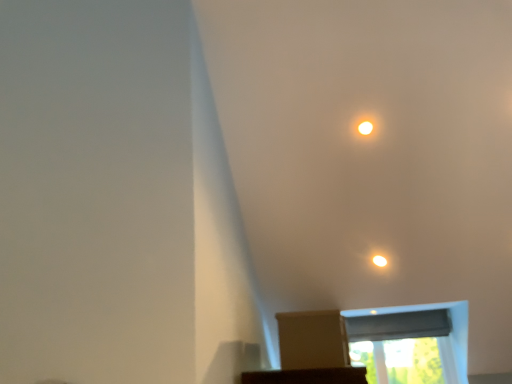
Question: Is black fabric window screen at lower center, the second window screen when ordered from bottom to top, closer to camera compared to matte white light at upper center?

Choices:
 (A) yes
 (B) no

Answer: (B)

Question: Is black fabric window screen at lower center, the 1th window screen in the top-to-bottom sequence, to the right of matte white light at upper center from the viewer's perspective?

Choices:
 (A) no
 (B) yes

Answer: (B)

Question: Can you confirm if black fabric window screen at lower center, the 1th window screen in the top-to-bottom sequence, is wider than matte white light at upper center?

Choices:
 (A) yes
 (B) no

Answer: (A)

Question: From a real-world perspective, is black fabric window screen at lower center, the 1th window screen in the top-to-bottom sequence, below matte white light at upper center?

Choices:
 (A) yes
 (B) no

Answer: (A)

Question: From the image's perspective, does black fabric window screen at lower center, the 1th window screen in the top-to-bottom sequence, appear higher than matte white light at upper center?

Choices:
 (A) yes
 (B) no

Answer: (B)

Question: Looking at the image, does brown cardboard box at center seem bigger or smaller compared to matte white light at upper center?

Choices:
 (A) small
 (B) big

Answer: (B)

Question: Is brown cardboard box at center situated inside matte white light at upper center or outside?

Choices:
 (A) inside
 (B) outside

Answer: (B)

Question: Is brown cardboard box at center taller or shorter than matte white light at upper center?

Choices:
 (A) tall
 (B) short

Answer: (A)

Question: Is brown cardboard box at center wider or thinner than matte white light at upper center?

Choices:
 (A) wide
 (B) thin

Answer: (A)

Question: Which is correct: black fabric window screen at lower center, the second window screen when ordered from bottom to top, is inside matte white light at upper center, or outside of it?

Choices:
 (A) inside
 (B) outside

Answer: (B)

Question: Considering the positions of black fabric window screen at lower center, the 1th window screen in the top-to-bottom sequence, and matte white light at upper center in the image, is black fabric window screen at lower center, the 1th window screen in the top-to-bottom sequence, taller or shorter than matte white light at upper center?

Choices:
 (A) tall
 (B) short

Answer: (A)

Question: From a real-world perspective, is black fabric window screen at lower center, the second window screen when ordered from bottom to top, above or below matte white light at upper center?

Choices:
 (A) above
 (B) below

Answer: (B)

Question: Does point (430, 329) appear closer or farther from the camera than point (372, 129)?

Choices:
 (A) farther
 (B) closer

Answer: (A)

Question: Based on their sizes in the image, would you say black fabric window screen at lower center, the second window screen when ordered from bottom to top, is bigger or smaller than transparent plastic window screen at upper center, arranged as the 2th window screen when viewed from the top?

Choices:
 (A) big
 (B) small

Answer: (B)

Question: Based on their positions, is black fabric window screen at lower center, the 1th window screen in the top-to-bottom sequence, located to the left or right of transparent plastic window screen at upper center, arranged as the 2th window screen when viewed from the top?

Choices:
 (A) left
 (B) right

Answer: (A)